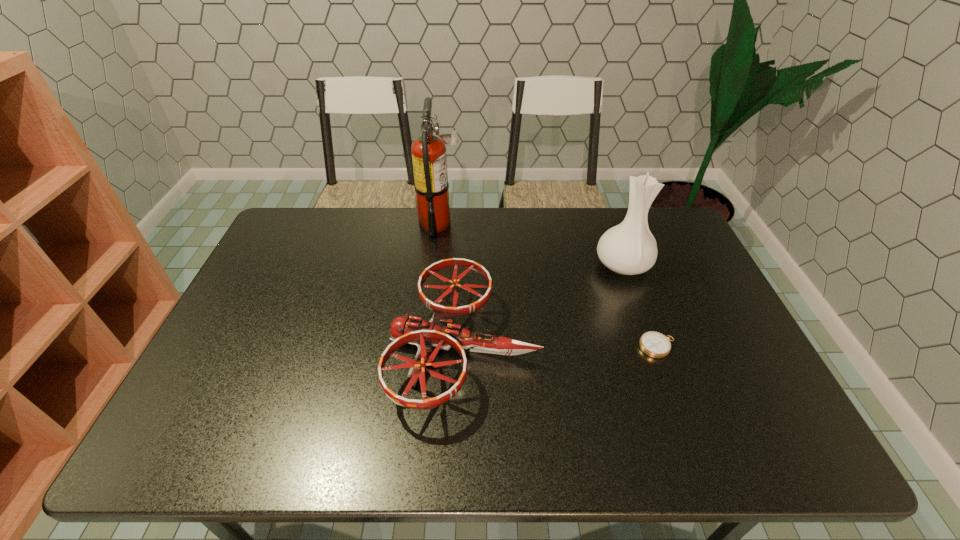
I want to click on fire extinguisher, so tap(429, 159).

The height and width of the screenshot is (540, 960). Identify the location of the tallest object. (429, 159).

Identify the location of the second tallest object. (x=629, y=248).

Locate an element on the screen. This screenshot has width=960, height=540. the second farthest object is located at coordinates (629, 248).

Where is `the second shortest object`? The width and height of the screenshot is (960, 540). the second shortest object is located at coordinates (440, 332).

Locate an element on the screen. Image resolution: width=960 pixels, height=540 pixels. the shortest object is located at coordinates (654, 344).

Locate an element on the screen. Image resolution: width=960 pixels, height=540 pixels. vacant space located from the nozzle of the fire extinguisher is located at coordinates (503, 224).

Where is `free space located on the right of the third nearest object`? The width and height of the screenshot is (960, 540). free space located on the right of the third nearest object is located at coordinates (685, 265).

Locate an element on the screen. free space located 0.400m on the back of the drone is located at coordinates (x=469, y=209).

Locate an element on the screen. vacant space located on the right of the shortest object is located at coordinates (733, 347).